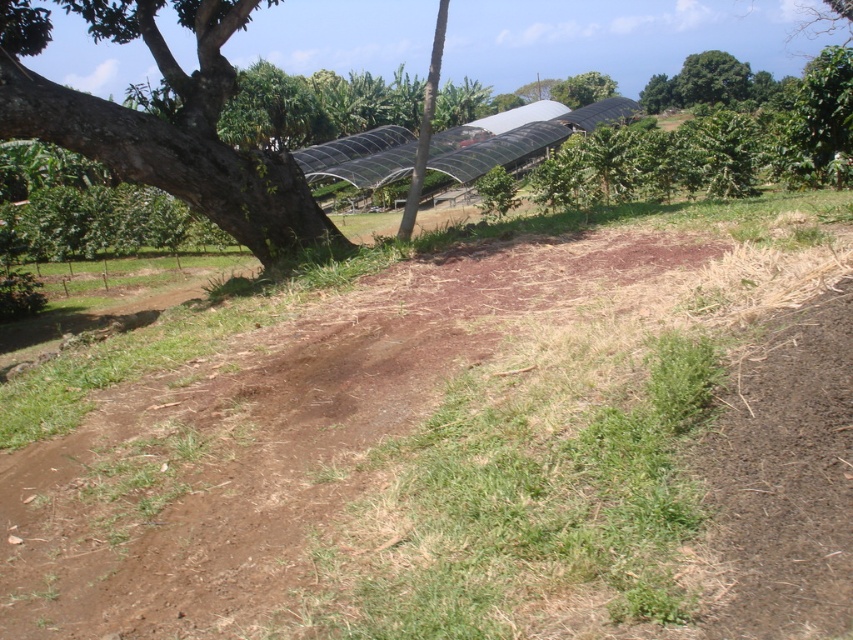
You are standing in the rural outdoor scene and want to take a photo of the brown rough bark tree at left without the green leafy tree at upper right blocking it. How should you adjust your position?

Move to the right side of the scene so that the green leafy tree at upper right is no longer blocking the view of the brown rough bark tree at left.